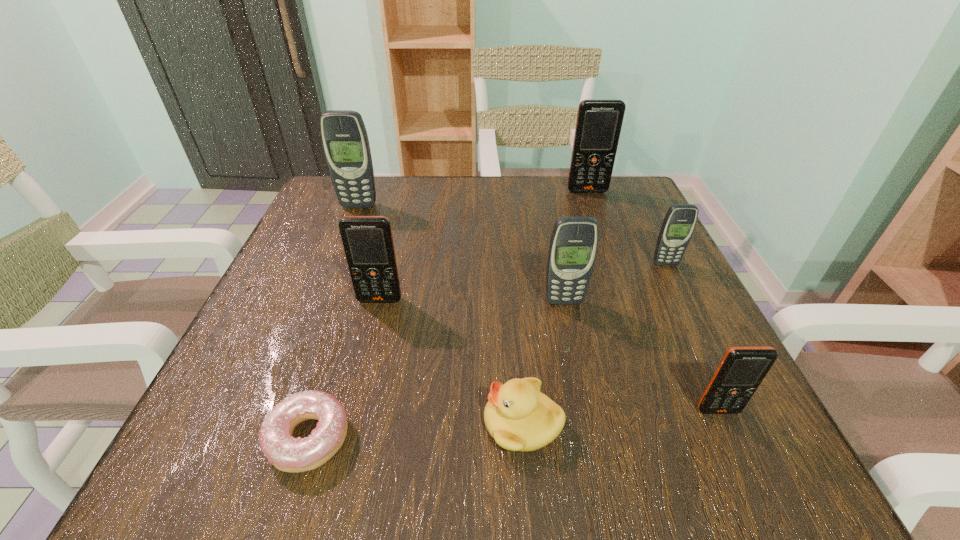
Where is `vacant space that is in between the duckling and the second smallest orange cellular telephone`? vacant space that is in between the duckling and the second smallest orange cellular telephone is located at coordinates [x=451, y=361].

Identify the location of free spot between the doughnut and the farthest cellular telephone. The height and width of the screenshot is (540, 960). (448, 314).

Locate an element on the screen. This screenshot has width=960, height=540. free space between the farthest object and the seventh tallest object is located at coordinates (555, 307).

You are a GUI agent. You are given a task and a screenshot of the screen. Output one action in this format:
    pyautogui.click(x=<x>, y=<y>)
    Task: Click on the free space that is in between the doughnut and the second gray cellular telephone from right to left
    Image resolution: width=960 pixels, height=540 pixels.
    Given the screenshot: What is the action you would take?
    pyautogui.click(x=436, y=370)

This screenshot has height=540, width=960. I want to click on empty space between the pink doughnut and the biggest orange cellular telephone, so click(x=448, y=314).

I want to click on vacant space that is in between the third farthest cellular telephone and the farthest object, so click(627, 227).

I want to click on free space between the sixth nearest object and the second farthest orange cellular telephone, so click(523, 282).

At what (x,y) coordinates should I click in order to perform the action: click on empty space that is in between the pink doughnut and the yellow duckling. Please return your answer as a coordinate pair (x, y). The width and height of the screenshot is (960, 540). Looking at the image, I should click on (416, 430).

I want to click on vacant space in between the smallest orange cellular telephone and the second shortest object, so click(x=620, y=416).

What are the coordinates of `object that stands as the sixth closest to the second farthest cellular telephone` in the screenshot? It's located at (677, 228).